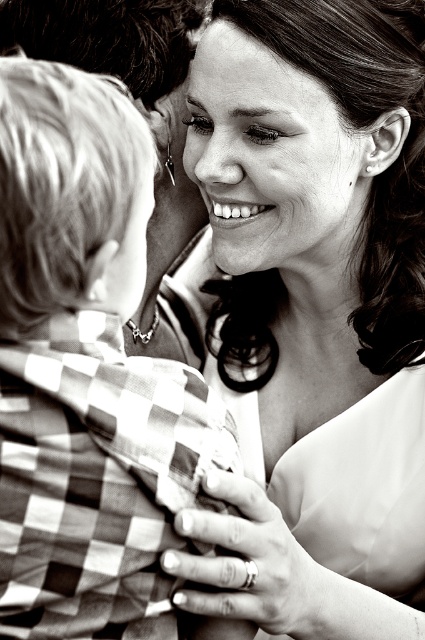
Question: Which point appears farthest from the camera in this image?

Choices:
 (A) tap(11, 584)
 (B) tap(217, 243)
 (C) tap(416, 461)

Answer: (C)

Question: Does checkered fabric shirt at left have a greater width compared to smooth skin face at upper center?

Choices:
 (A) yes
 (B) no

Answer: (B)

Question: Which of the following is the closest to the observer?

Choices:
 (A) (231, 58)
 (B) (25, 573)
 (C) (402, 621)

Answer: (B)

Question: Among these objects, which one is nearest to the camera?

Choices:
 (A) checkered fabric shirt at left
 (B) smooth skin at upper center
 (C) smooth skin face at upper center

Answer: (A)

Question: Can you confirm if checkered fabric shirt at left is smaller than smooth skin face at upper center?

Choices:
 (A) yes
 (B) no

Answer: (B)

Question: Is checkered fabric shirt at left to the left of smooth skin face at upper center from the viewer's perspective?

Choices:
 (A) no
 (B) yes

Answer: (B)